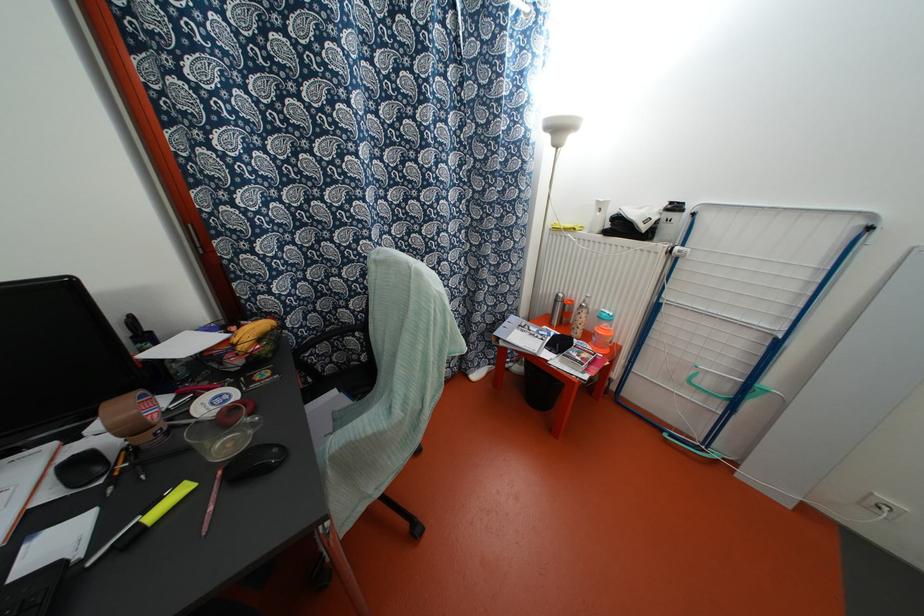
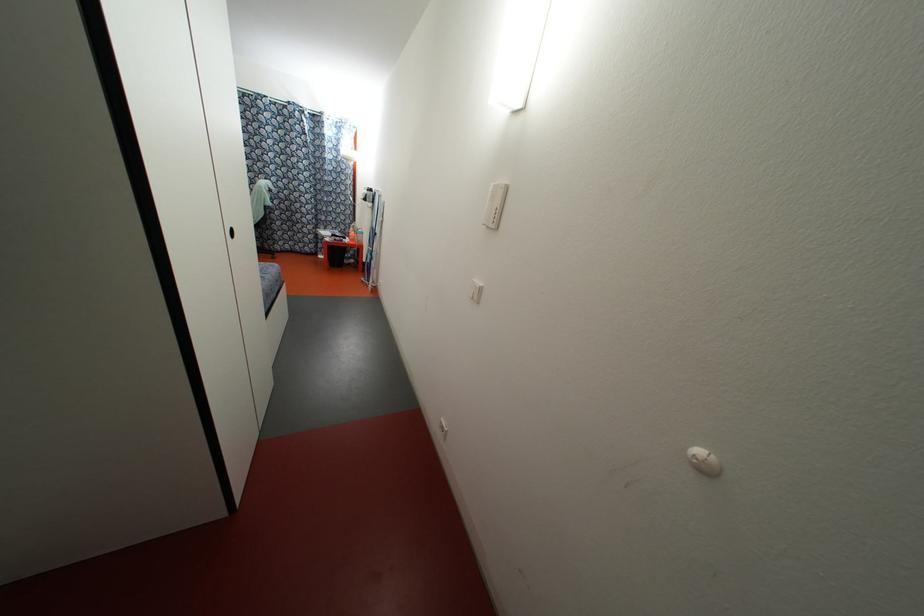
In a continuous first-person perspective shot, in which direction is the camera moving?

The cameraman walked toward right, backward.